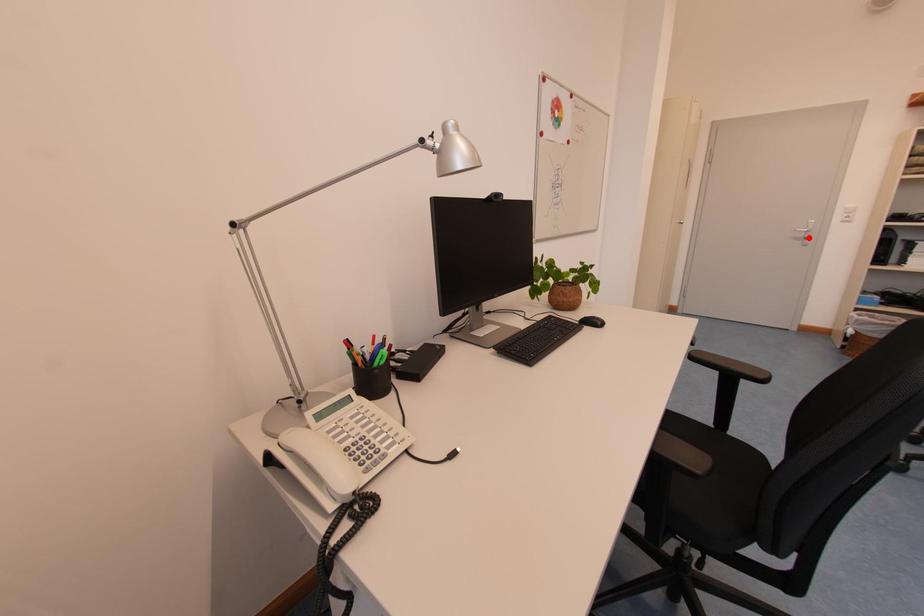
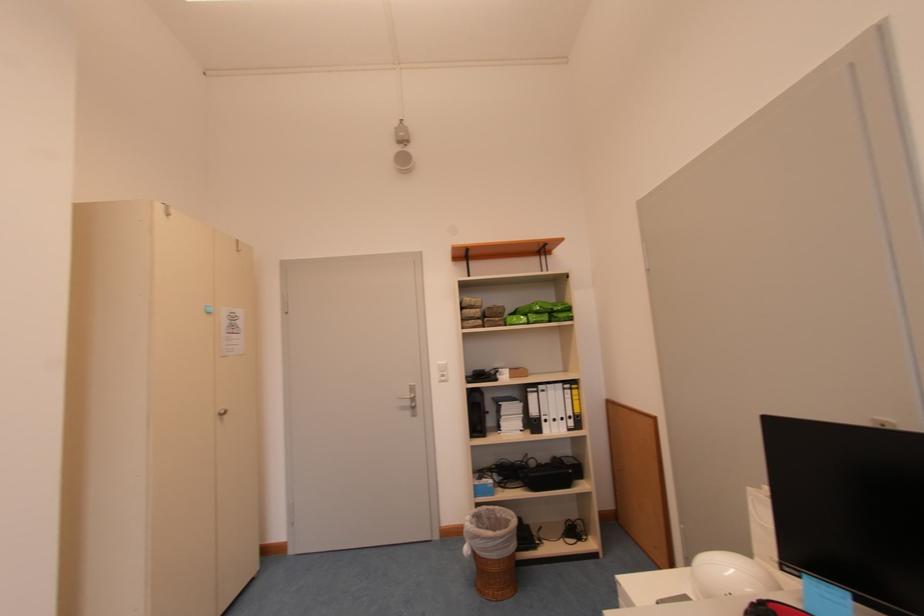
Locate, in the second image, the point that corresponds to the highlighted location in the first image.

(415, 406)